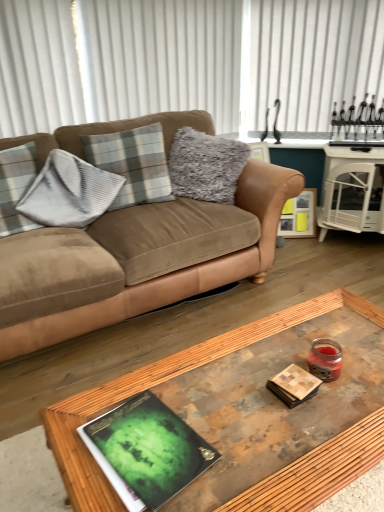
Locate an element on the screen. vacant area located to the right-hand side of matte brown book at center is located at coordinates (357, 389).